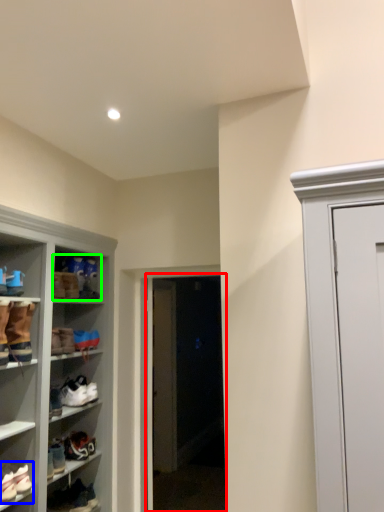
Question: Estimate the real-world distances between objects in this image. Which object is closer to glass door (highlighted by a red box), footwear (highlighted by a blue box) or footwear (highlighted by a green box)?

Choices:
 (A) footwear
 (B) footwear

Answer: (B)